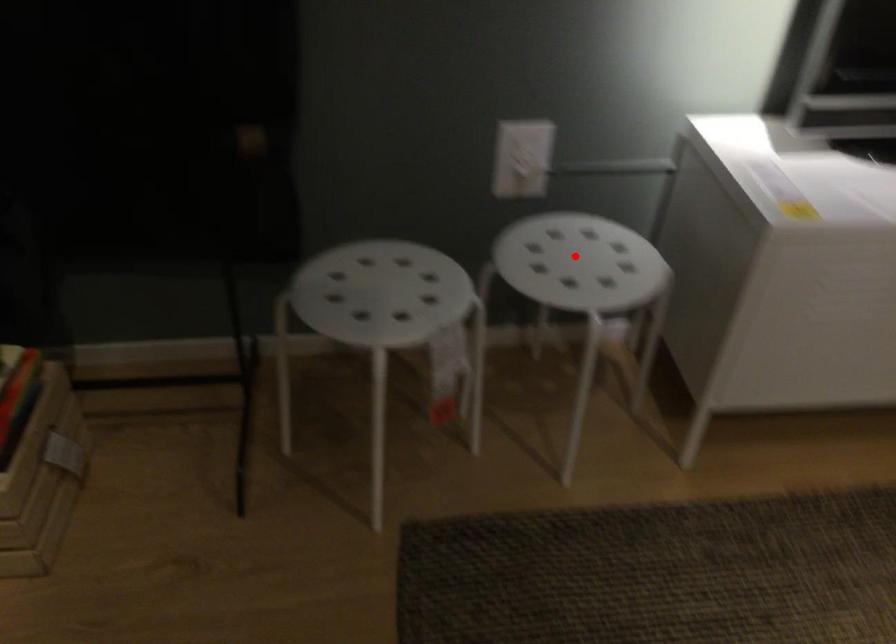
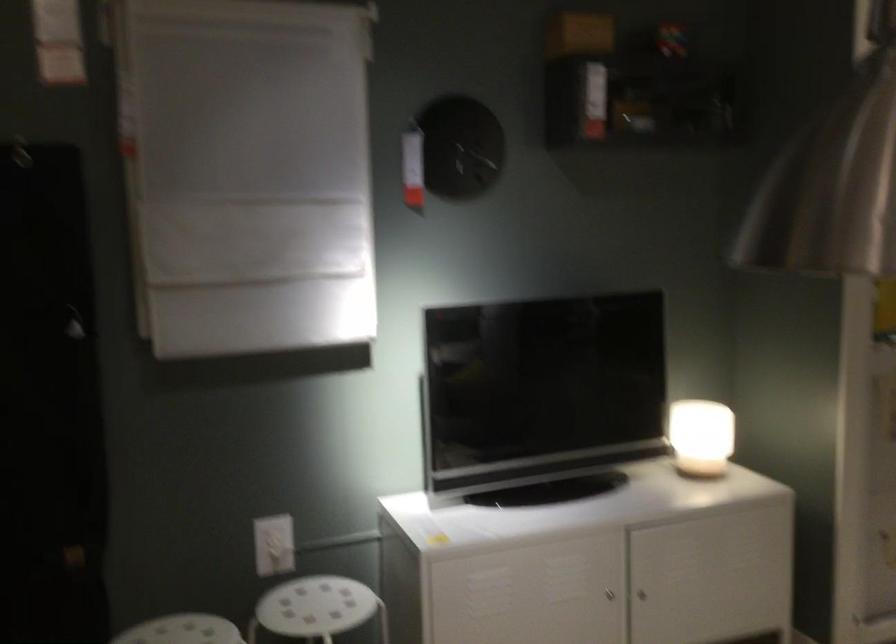
Question: I am providing you with two images of the same scene from different viewpoints. In image1, a red point is highlighted. Considering the same 3D point in image2, which of the following is correct?

Choices:
 (A) It is closer
 (B) It is farther

Answer: (B)